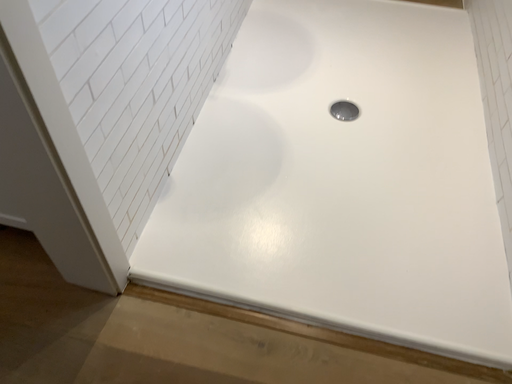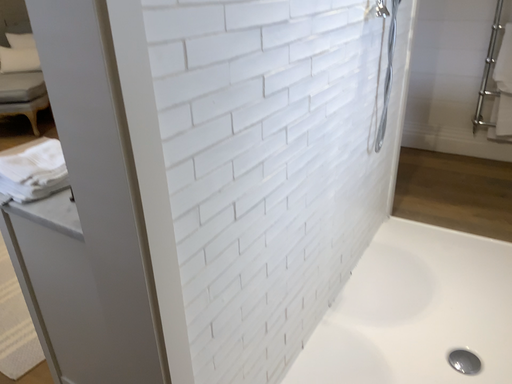
Question: Which way did the camera rotate in the video?

Choices:
 (A) rotated left
 (B) rotated right

Answer: (A)